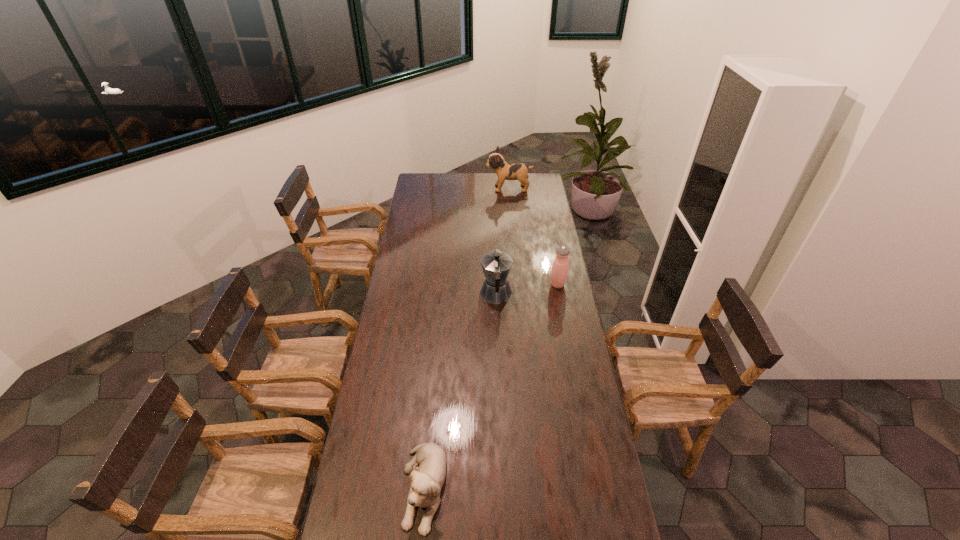
This screenshot has width=960, height=540. I want to click on vacant area between the nearer puppy and the farther puppy, so click(467, 338).

The height and width of the screenshot is (540, 960). I want to click on vacant region between the coffeepot and the nearer puppy, so click(x=460, y=391).

At what (x,y) coordinates should I click in order to perform the action: click on object that stands as the second closest to the thermos bottle. Please return your answer as a coordinate pair (x, y). The height and width of the screenshot is (540, 960). Looking at the image, I should click on (505, 171).

Where is `object that is the closest to the thermos bottle`? Image resolution: width=960 pixels, height=540 pixels. object that is the closest to the thermos bottle is located at coordinates (496, 265).

Locate an element on the screen. free point that satisfies the following two spatial constraints: 1. at the spout of the coffeepot; 2. on the right side of the rightmost object is located at coordinates (495, 285).

Locate an element on the screen. free point that satisfies the following two spatial constraints: 1. at the face of the thermos bottle; 2. on the left side of the farthest object is located at coordinates (517, 285).

Locate an element on the screen. The image size is (960, 540). free spot that satisfies the following two spatial constraints: 1. at the spout of the coffeepot; 2. on the left side of the thermos bottle is located at coordinates (495, 285).

Where is `vacant position in the image that satisfies the following two spatial constraints: 1. at the spout of the thermos bottle; 2. on the right side of the coffeepot`? Image resolution: width=960 pixels, height=540 pixels. vacant position in the image that satisfies the following two spatial constraints: 1. at the spout of the thermos bottle; 2. on the right side of the coffeepot is located at coordinates (495, 285).

Find the location of a particular element. The height and width of the screenshot is (540, 960). free region that satisfies the following two spatial constraints: 1. at the spout of the thermos bottle; 2. on the right side of the coffeepot is located at coordinates (495, 285).

Find the location of `vacant space that satisfies the following two spatial constraints: 1. at the spout of the rightmost object; 2. on the left side of the coffeepot`. vacant space that satisfies the following two spatial constraints: 1. at the spout of the rightmost object; 2. on the left side of the coffeepot is located at coordinates (495, 285).